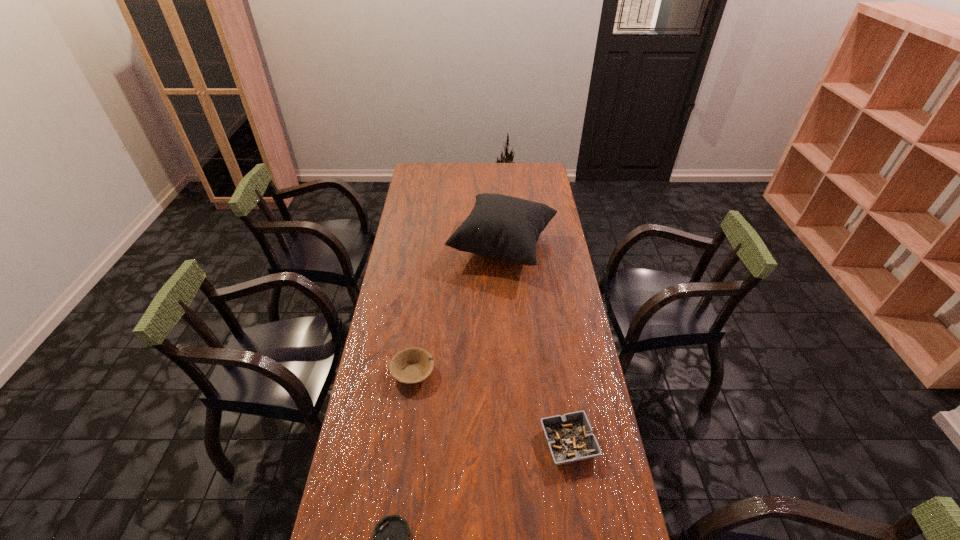
Image resolution: width=960 pixels, height=540 pixels. What are the coordinates of `ashtray located in the right edge section of the desktop` in the screenshot? It's located at (570, 438).

You are a GUI agent. You are given a task and a screenshot of the screen. Output one action in this format:
    pyautogui.click(x=<x>, y=<y>)
    Task: Click on the free region at the far edge of the desktop
    
    Given the screenshot: What is the action you would take?
    pyautogui.click(x=442, y=168)

In the image, there is a desktop. Find the location of `free space at the left edge`. free space at the left edge is located at coordinates (370, 395).

In the image, there is a desktop. In order to click on free space at the right edge in this screenshot , I will do `click(601, 443)`.

This screenshot has height=540, width=960. Identify the location of free space at the far right corner of the desktop. (531, 168).

Find the location of a particular element. free area in between the right ashtray and the tallest object is located at coordinates pyautogui.click(x=536, y=345).

This screenshot has width=960, height=540. Find the location of `free space between the bowl and the farthest object`. free space between the bowl and the farthest object is located at coordinates (458, 309).

This screenshot has width=960, height=540. What are the coordinates of `free spot between the tallest object and the farther ashtray` in the screenshot? It's located at (536, 345).

The width and height of the screenshot is (960, 540). Identify the location of vacant area between the bowl and the taller ashtray. (491, 408).

Image resolution: width=960 pixels, height=540 pixels. I want to click on free space between the second nearest object and the cushion, so tap(536, 345).